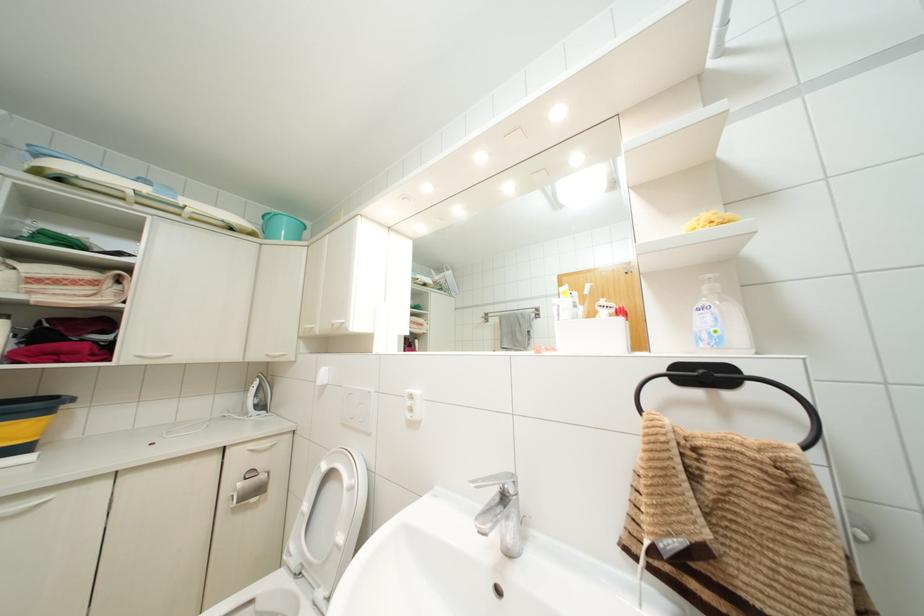
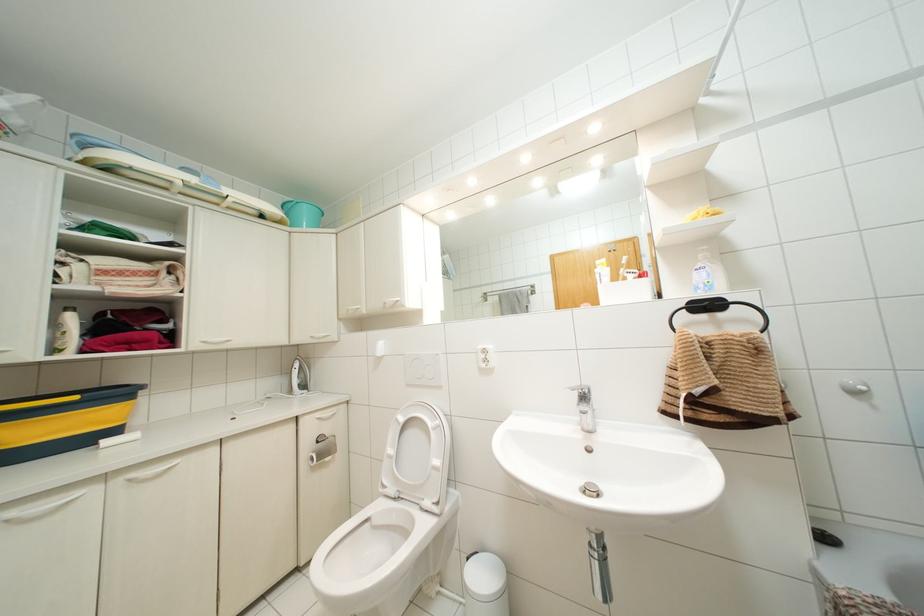
Find the pixel in the second image that matches pixel 305 506 in the first image.

(390, 450)